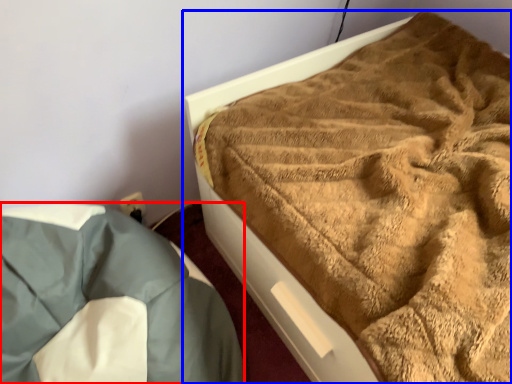
Question: Which object appears closest to the camera in this image, bedding (highlighted by a red box) or bed (highlighted by a blue box)?

Choices:
 (A) bedding
 (B) bed

Answer: (A)